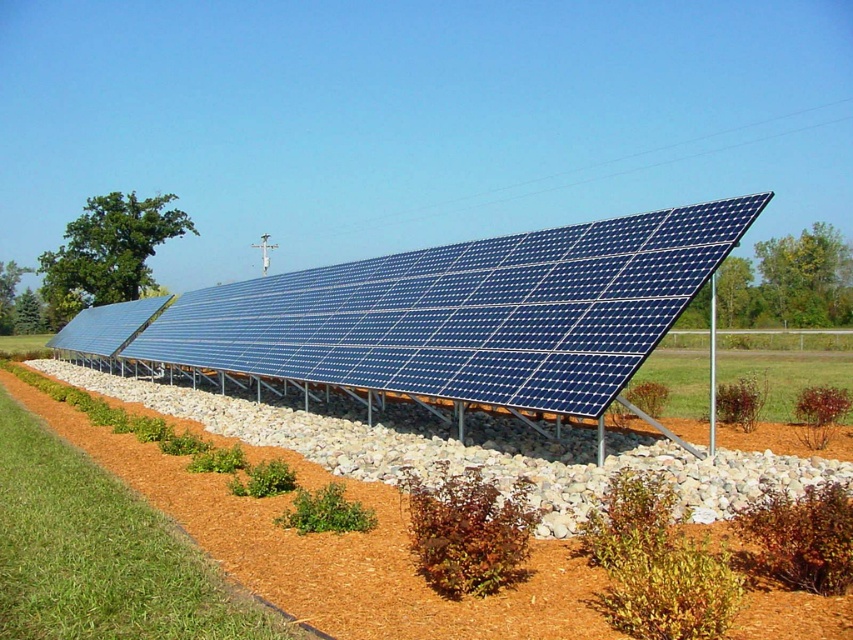
You are standing at the point marked by the coordinates point (456, 314) in the image. Looking around, you see the blue solar panel at center. What is directly beneath your feet?

The point (456, 314) indicates the blue solar panel at center is directly beneath your feet.